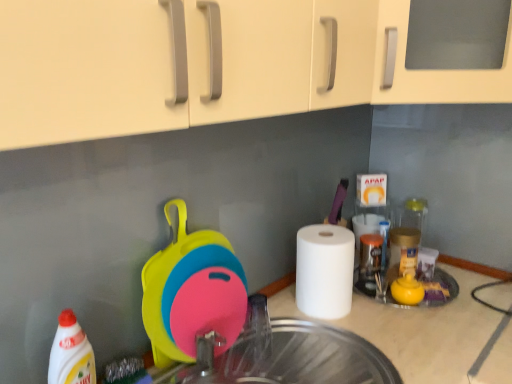
Question: In terms of width, does white matte paper towel at right look wider or thinner when compared to transparent glass sink at center?

Choices:
 (A) thin
 (B) wide

Answer: (A)

Question: Choose the correct answer: Is white matte paper towel at right inside transparent glass sink at center or outside it?

Choices:
 (A) outside
 (B) inside

Answer: (A)

Question: Which of these objects is positioned closest to the silicone cutting board at center?

Choices:
 (A) metallic silver faucet at center
 (B) transparent glass sink at center
 (C) white matte paper towel at right
 (D) white glossy bottle at lower left

Answer: (B)

Question: Which is nearer to the silicone cutting board at center?

Choices:
 (A) white matte paper towel at right
 (B) metallic silver faucet at center
 (C) white glossy bottle at lower left
 (D) transparent glass sink at center

Answer: (D)